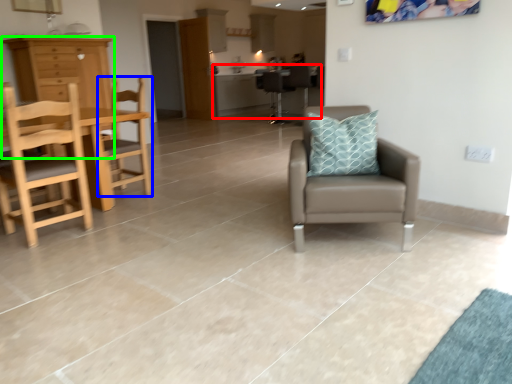
Question: Considering the real-world distances, which object is closest to table (highlighted by a red box)? chair (highlighted by a blue box) or cabinetry (highlighted by a green box).

Choices:
 (A) chair
 (B) cabinetry

Answer: (A)